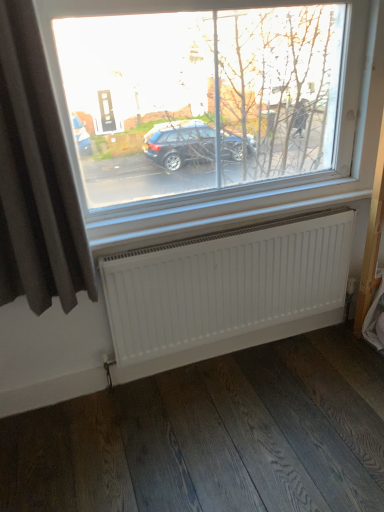
Question: Is dark grey fabric curtain at left wider or thinner than white matte radiator at lower center?

Choices:
 (A) thin
 (B) wide

Answer: (B)

Question: From the image's perspective, relative to white matte radiator at lower center, is dark grey fabric curtain at left above or below?

Choices:
 (A) below
 (B) above

Answer: (B)

Question: In terms of height, does dark grey fabric curtain at left look taller or shorter compared to white matte radiator at lower center?

Choices:
 (A) short
 (B) tall

Answer: (B)

Question: Relative to dark grey fabric curtain at left, is white matte radiator at lower center in front or behind?

Choices:
 (A) front
 (B) behind

Answer: (B)

Question: Would you say white matte radiator at lower center is to the left or to the right of dark grey fabric curtain at left in the picture?

Choices:
 (A) right
 (B) left

Answer: (A)

Question: Does point (238, 268) appear closer or farther from the camera than point (92, 294)?

Choices:
 (A) farther
 (B) closer

Answer: (A)

Question: Looking at the image, does white matte radiator at lower center seem bigger or smaller compared to dark grey fabric curtain at left?

Choices:
 (A) big
 (B) small

Answer: (B)